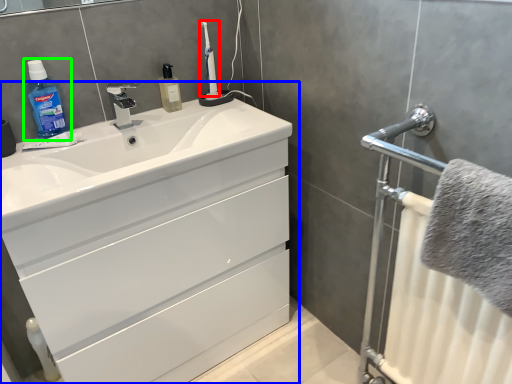
Question: Considering the real-world distances, which object is closest to toothbrush (highlighted by a red box)? bathroom cabinet (highlighted by a blue box) or cleaning product (highlighted by a green box).

Choices:
 (A) bathroom cabinet
 (B) cleaning product

Answer: (B)